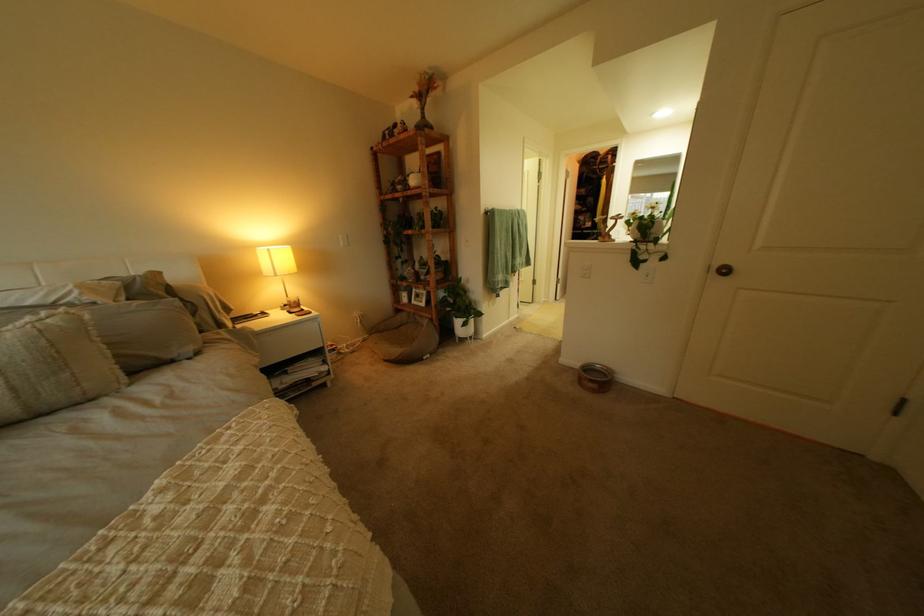
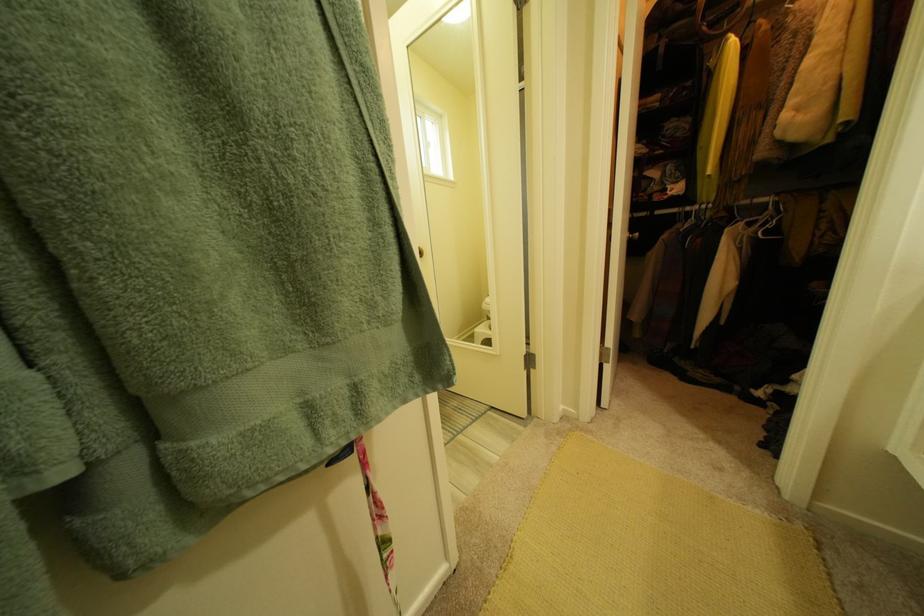
Question: What movement of the cameraman would produce the second image?

Choices:
 (A) Left
 (B) Right
 (C) Forward
 (D) Backward

Answer: (C)